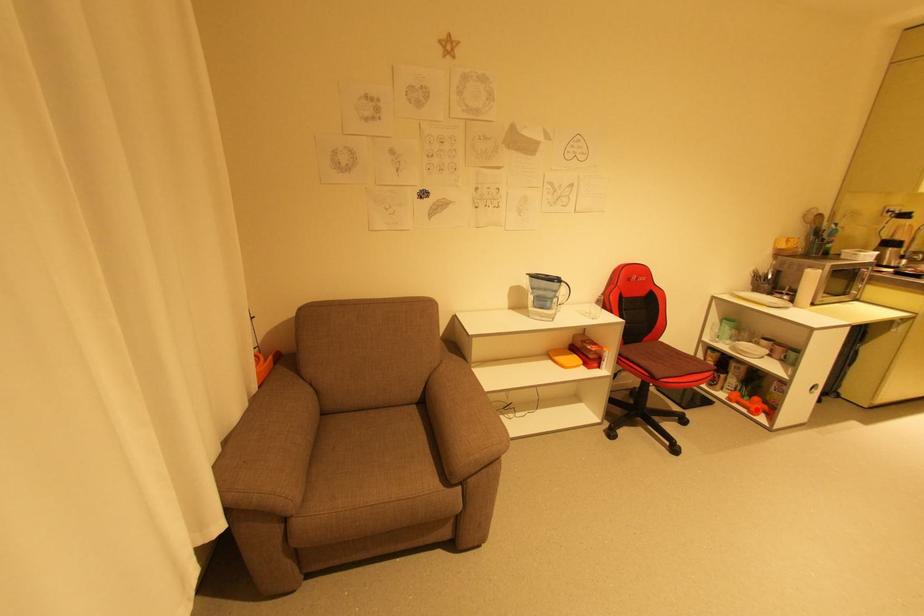
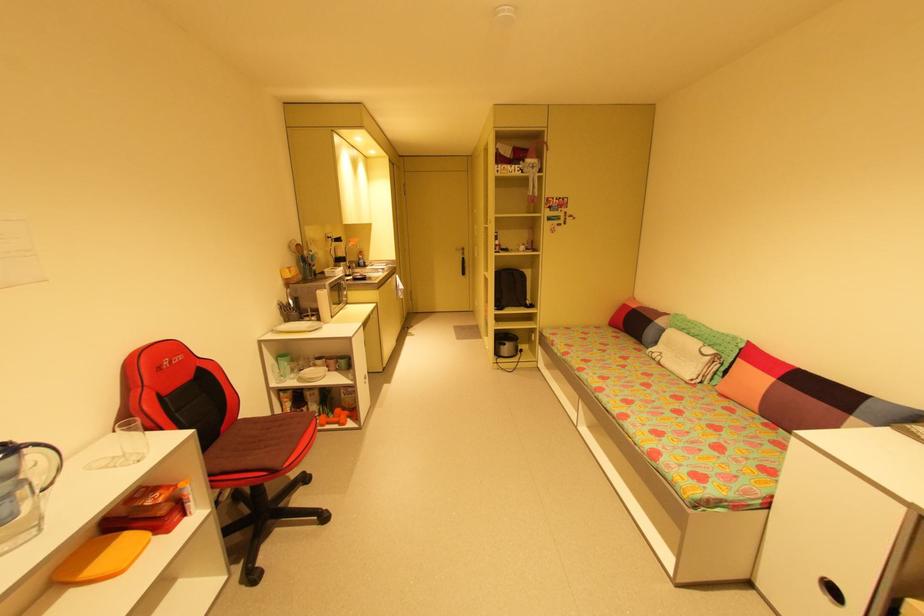
In the second image, find the point that corresponds to the highlighted location in the first image.

(345, 422)